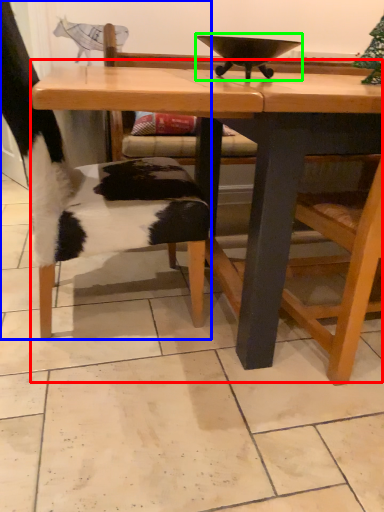
Question: Which object is positioned farthest from table (highlighted by a red box)? Select from chair (highlighted by a blue box) and bowl (highlighted by a green box).

Choices:
 (A) chair
 (B) bowl

Answer: (B)